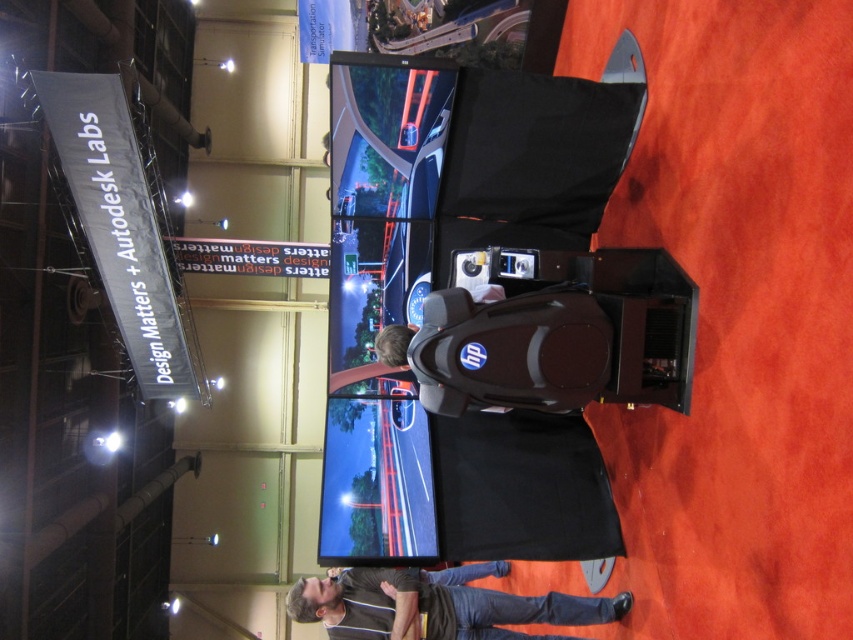
Who is higher up, black plastic chair at center or dark gray shirt at center?

Positioned higher is black plastic chair at center.

Find the location of a particular element. This screenshot has height=640, width=853. black plastic chair at center is located at coordinates (503, 349).